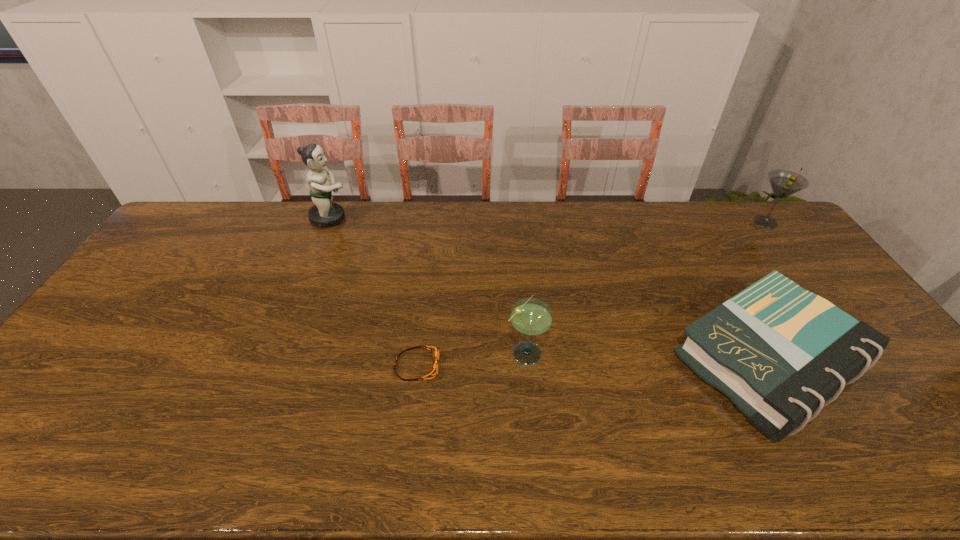
Image resolution: width=960 pixels, height=540 pixels. What are the coordinates of `the tallest object` in the screenshot? It's located at (325, 213).

This screenshot has height=540, width=960. I want to click on the leftmost object, so click(325, 213).

I want to click on the fourth shortest object, so click(x=784, y=183).

Locate an element on the screen. the farther martini is located at coordinates (784, 183).

What are the coordinates of `the shorter martini` in the screenshot? It's located at (532, 317).

I want to click on the third shortest object, so click(x=532, y=317).

Identify the location of paperback book. The height and width of the screenshot is (540, 960). (781, 353).

Locate an element on the screen. The image size is (960, 540). the shortest object is located at coordinates (433, 371).

Find the location of a particular element. The image size is (960, 540). goggles is located at coordinates (433, 371).

This screenshot has height=540, width=960. Find the location of `vacant area situated on the front-facing side of the figurine`. vacant area situated on the front-facing side of the figurine is located at coordinates (x=401, y=218).